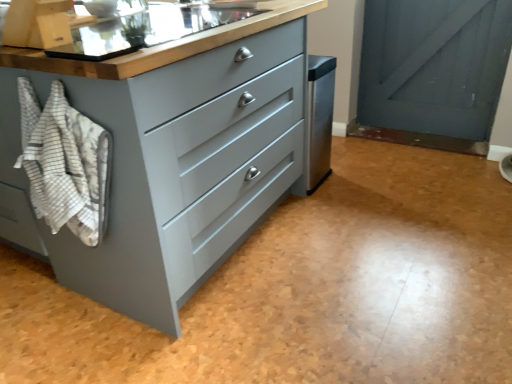
Question: From the image's perspective, is matte stainless steel sink at upper center above or below white striped towel at left?

Choices:
 (A) above
 (B) below

Answer: (A)

Question: Based on their sizes in the image, would you say matte stainless steel sink at upper center is bigger or smaller than white striped towel at left?

Choices:
 (A) small
 (B) big

Answer: (B)

Question: Which object is positioned farthest from the matte stainless steel sink at upper center?

Choices:
 (A) white striped towel at left
 (B) matte gray chest of drawers at center

Answer: (A)

Question: Which of these objects is positioned closest to the white striped towel at left?

Choices:
 (A) matte gray chest of drawers at center
 (B) matte stainless steel sink at upper center

Answer: (A)